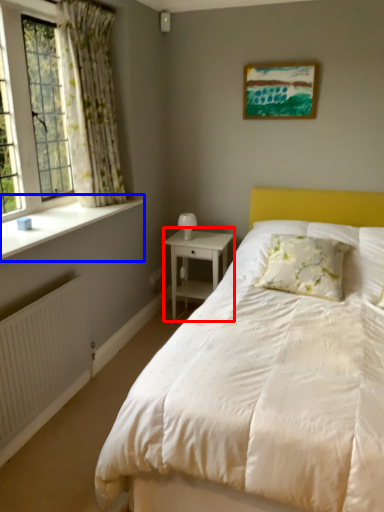
Question: Which object is closer to the camera taking this photo, nightstand (highlighted by a red box) or window sill (highlighted by a blue box)?

Choices:
 (A) nightstand
 (B) window sill

Answer: (B)